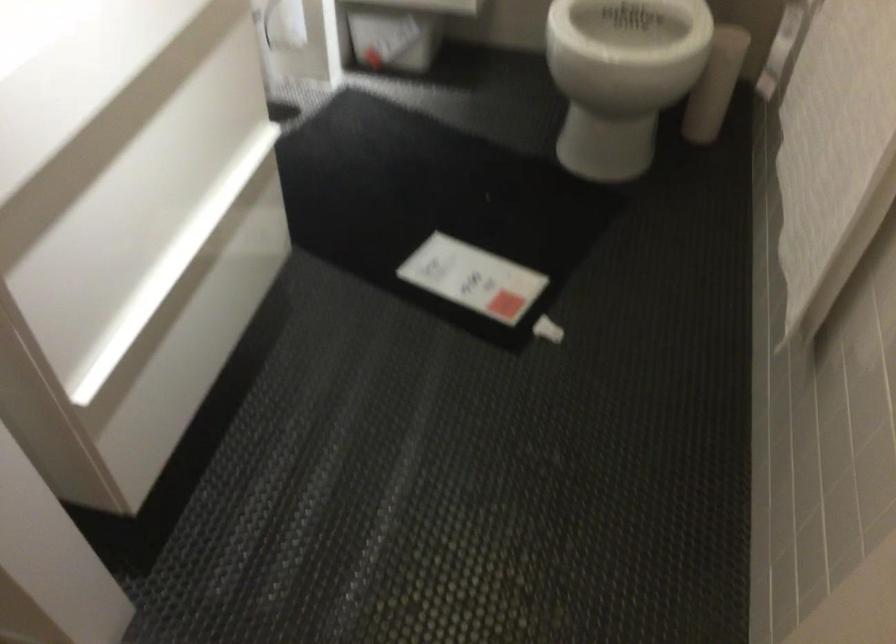
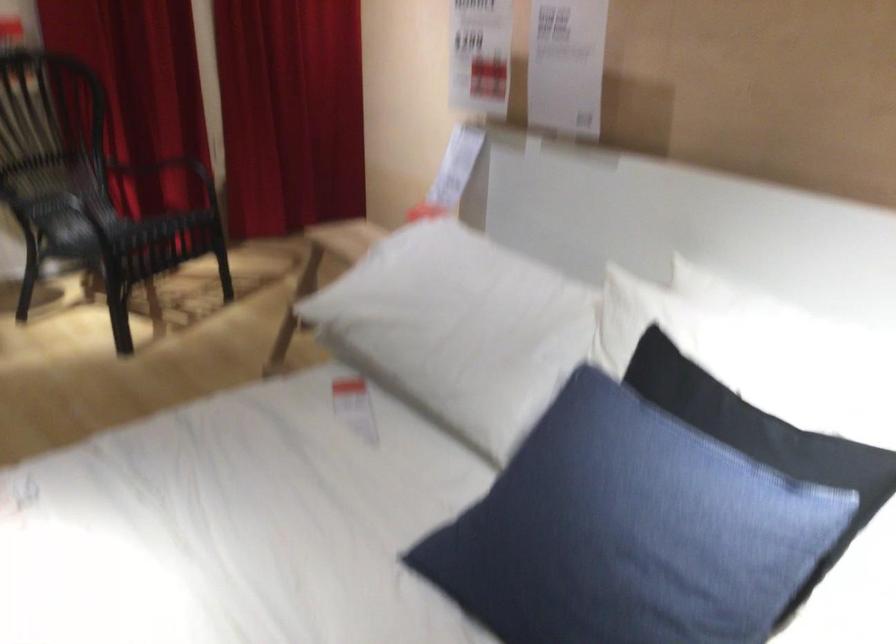
Question: I am providing you with two images of the same scene from different viewpoints. Please identify which objects are invisible in image2.

Choices:
 (A) white drawer handle
 (B) cabinet handle hole
 (C) chair sitting surface
 (D) blue pillow

Answer: (A)